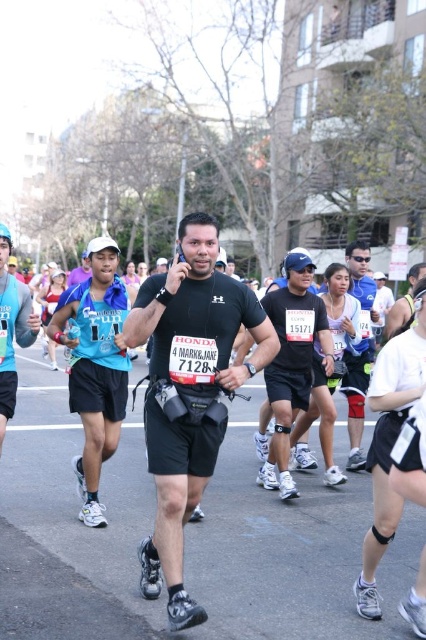
Does black matte running shorts at center come in front of black matte shorts at center?

Yes, black matte running shorts at center is in front of black matte shorts at center.

Is black matte running shorts at center smaller than black matte shorts at center?

Correct, black matte running shorts at center occupies less space than black matte shorts at center.

Is point (190, 321) closer to camera compared to point (287, 392)?

Yes, point (190, 321) is in front of point (287, 392).

I want to click on black matte running shorts at center, so click(189, 392).

Who is taller, black matte running shorts at center or blue fabric shirt at left?

black matte running shorts at center

Is black matte running shorts at center smaller than blue fabric shirt at left?

Incorrect, black matte running shorts at center is not smaller in size than blue fabric shirt at left.

Locate an element on the screen. This screenshot has width=426, height=640. black matte running shorts at center is located at coordinates (189, 392).

At what (x,y) coordinates should I click in order to perform the action: click on black matte running shorts at center. Please return your answer as a coordinate pair (x, y). Looking at the image, I should click on tap(189, 392).

Between point (166, 532) and point (359, 401), which one is positioned in front?

Point (166, 532)

Image resolution: width=426 pixels, height=640 pixels. I want to click on black matte running shorts at center, so click(x=189, y=392).